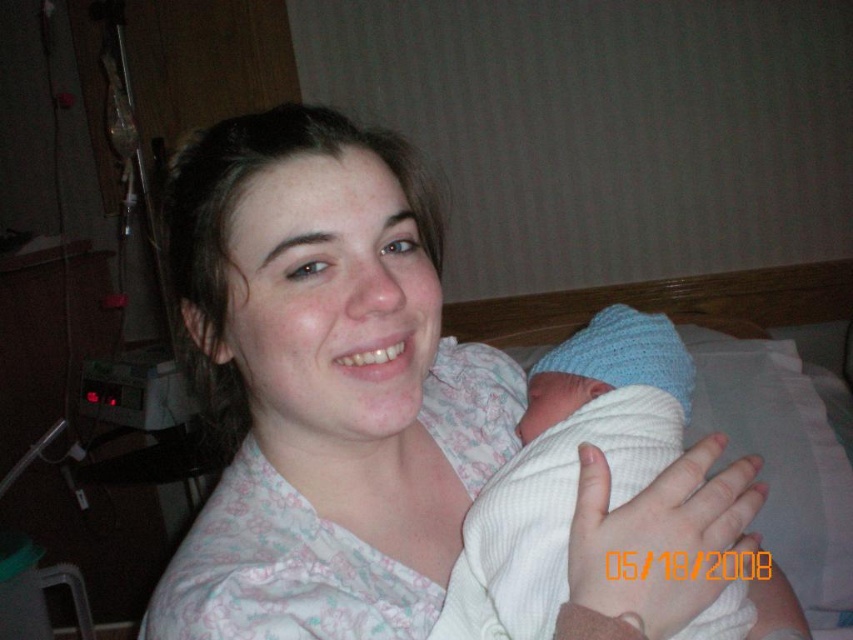
Does white cotton shirt at center have a larger size compared to white knit hat at upper right?

Indeed, white cotton shirt at center has a larger size compared to white knit hat at upper right.

Locate an element on the screen. The width and height of the screenshot is (853, 640). white cotton shirt at center is located at coordinates (322, 385).

The image size is (853, 640). I want to click on white cotton shirt at center, so click(322, 385).